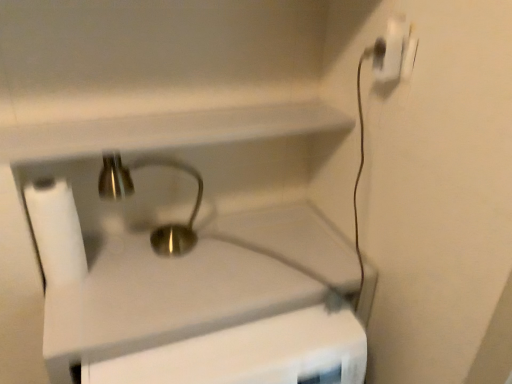
Find the location of a particular element. free space in front of white matte toilet paper at left is located at coordinates (x=78, y=314).